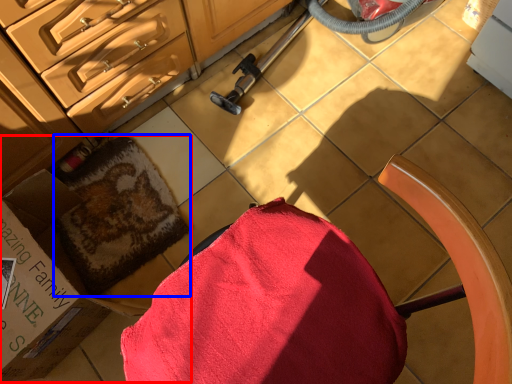
Question: Which point is further to the camera, box (highlighted by a red box) or bath towel (highlighted by a blue box)?

Choices:
 (A) box
 (B) bath towel

Answer: (B)